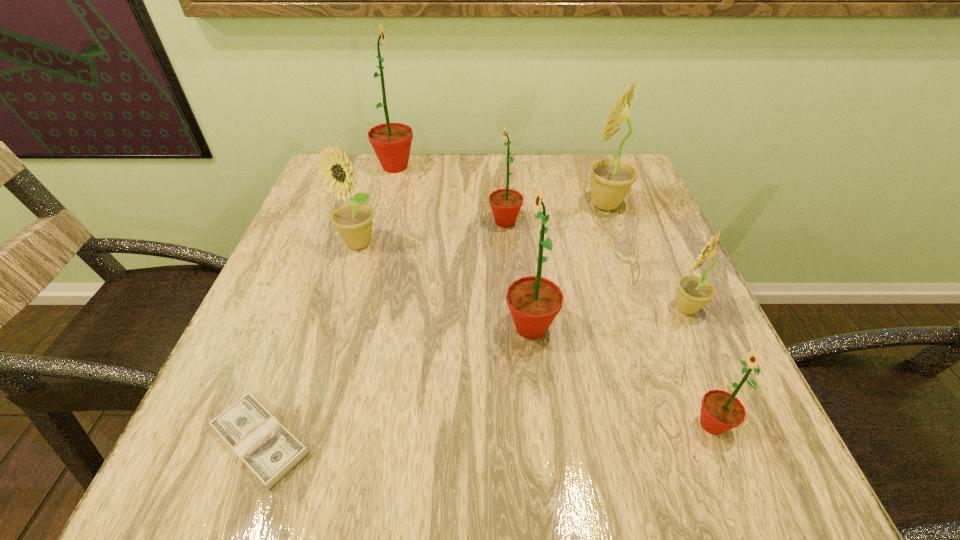
Where is `free space at the near left corner of the desktop`? This screenshot has height=540, width=960. free space at the near left corner of the desktop is located at coordinates (223, 466).

The image size is (960, 540). In order to click on free area in between the farthest sunflower and the third biggest green sunflower in this screenshot , I will do `click(450, 194)`.

In order to click on blank region between the biggest green sunflower and the farthest yellow sunflower in this screenshot , I will do `click(500, 186)`.

At what (x,y) coordinates should I click in order to perform the action: click on empty location between the second farthest green sunflower and the tallest object. Please return your answer as a coordinate pair (x, y). Image resolution: width=960 pixels, height=540 pixels. Looking at the image, I should click on pos(450,194).

Where is `blank region between the second smallest green sunflower and the dollar`? blank region between the second smallest green sunflower and the dollar is located at coordinates (382, 331).

This screenshot has width=960, height=540. I want to click on vacant region between the shortest object and the third farthest green sunflower, so click(396, 384).

Locate an element on the screen. The image size is (960, 540). unoccupied area between the leftmost yellow sunflower and the third biggest green sunflower is located at coordinates (432, 233).

Where is `empty location between the nearest sunflower and the dollar`? empty location between the nearest sunflower and the dollar is located at coordinates (486, 433).

Locate an element on the screen. Image resolution: width=960 pixels, height=540 pixels. blank region between the biggest yellow sunflower and the third nearest green sunflower is located at coordinates (555, 213).

Select which object is the sixth closest to the smallest yellow sunflower. Please provide its 2D coordinates. Your answer should be formatted as a tuple, i.e. [(x, y)], where the tuple contains the x and y coordinates of a point satisfying the conditions above.

[(270, 451)]